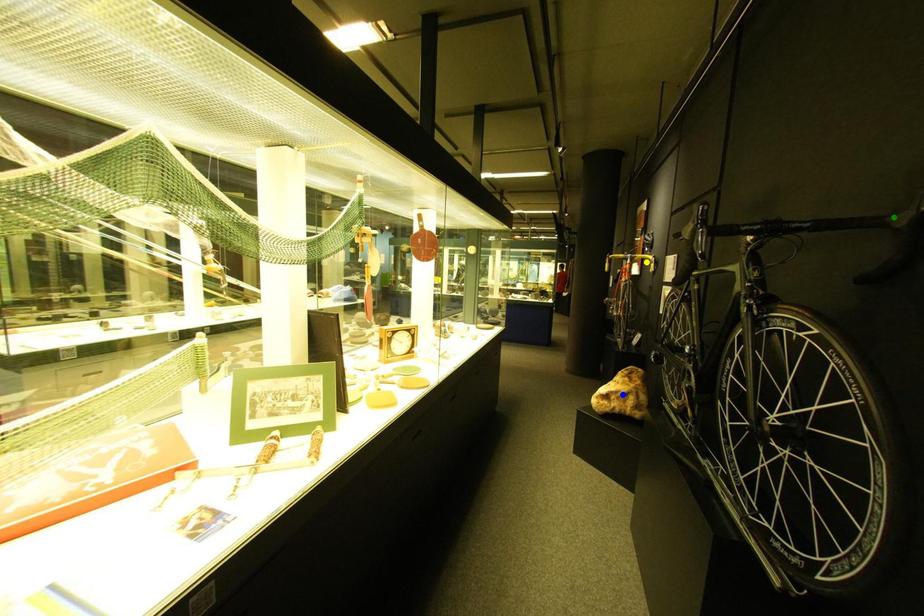
Order these from farthest to nearest:
1. green point
2. blue point
3. yellow point

1. yellow point
2. blue point
3. green point